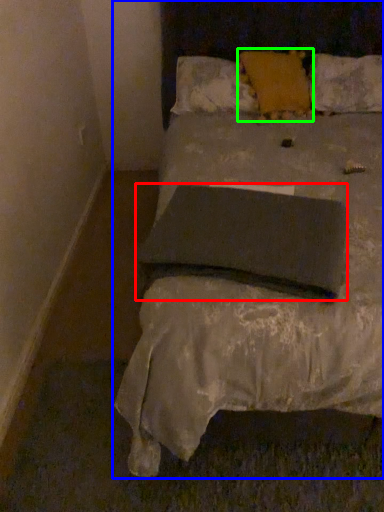
Question: Considering the real-world distances, which object is farthest from pillow (highlighted by a red box)? bed (highlighted by a blue box) or pillow (highlighted by a green box)?

Choices:
 (A) bed
 (B) pillow

Answer: (B)